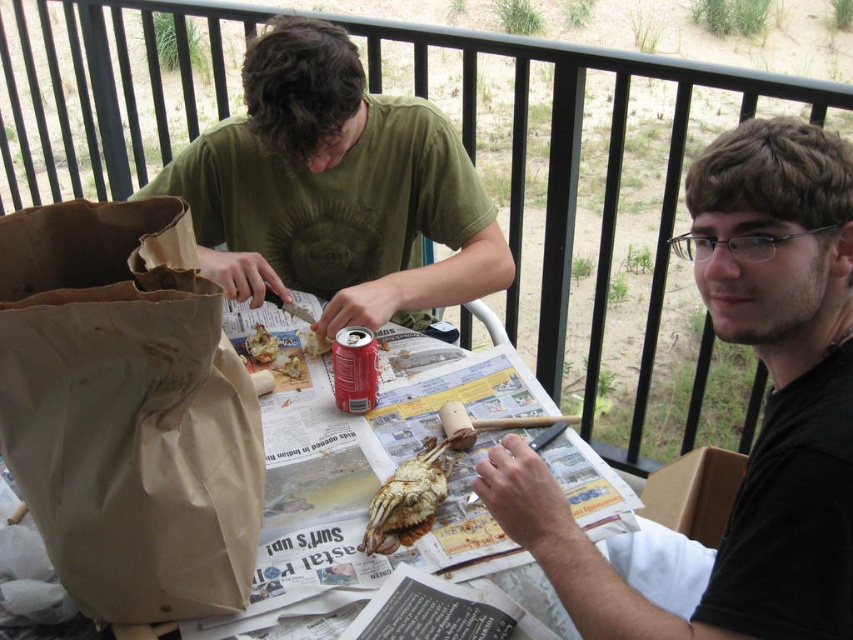
Question: Which point is farther to the camera?

Choices:
 (A) brown paper bag at center
 (B) black matte shirt at upper right
 (C) brown纸质螃蟹 at center

Answer: (C)

Question: Considering the relative positions of brown paper bag at left and brown纸质螃蟹 at center in the image provided, where is brown paper bag at left located with respect to brown纸质螃蟹 at center?

Choices:
 (A) right
 (B) left

Answer: (B)

Question: Based on their relative distances, which object is farther from the brown paper bag at center?

Choices:
 (A) black matte shirt at upper right
 (B) brown paper bag at left
 (C) brown纸质螃蟹 at center

Answer: (A)

Question: Estimate the real-world distances between objects in this image. Which object is closer to the brown paper bag at center?

Choices:
 (A) brown纸质螃蟹 at center
 (B) black matte shirt at upper right
 (C) brown paper bag at left

Answer: (A)

Question: Observing the image, what is the correct spatial positioning of black matte shirt at upper right in reference to green matte shirt at upper left?

Choices:
 (A) below
 (B) above

Answer: (A)

Question: Can you confirm if green matte shirt at upper left is thinner than brown纸质螃蟹 at center?

Choices:
 (A) no
 (B) yes

Answer: (A)